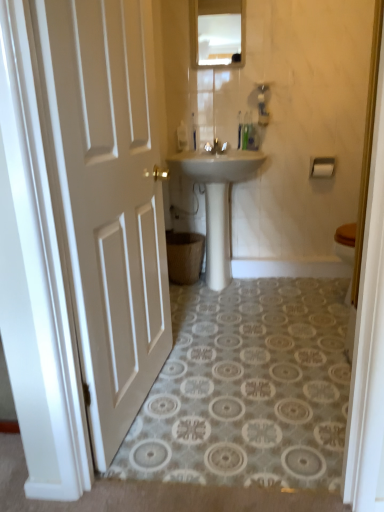
Question: From a real-world perspective, is white matte door at left positioned under glossy glass mirror at upper center based on gravity?

Choices:
 (A) yes
 (B) no

Answer: (A)

Question: Is white matte door at left looking in the opposite direction of glossy glass mirror at upper center?

Choices:
 (A) yes
 (B) no

Answer: (B)

Question: Is white matte door at left positioned in front of glossy glass mirror at upper center?

Choices:
 (A) no
 (B) yes

Answer: (B)

Question: Is there a large distance between white matte door at left and glossy glass mirror at upper center?

Choices:
 (A) no
 (B) yes

Answer: (B)

Question: Is white matte door at left surrounding glossy glass mirror at upper center?

Choices:
 (A) no
 (B) yes

Answer: (A)

Question: Based on their sizes in the image, would you say white matte door at left is bigger or smaller than matte white faucet at center?

Choices:
 (A) big
 (B) small

Answer: (A)

Question: Is point (107, 131) closer or farther from the camera than point (213, 139)?

Choices:
 (A) farther
 (B) closer

Answer: (B)

Question: In the image, is white matte door at left positioned in front of or behind matte white faucet at center?

Choices:
 (A) front
 (B) behind

Answer: (A)

Question: In the image, is white matte door at left on the left side or the right side of matte white faucet at center?

Choices:
 (A) right
 (B) left

Answer: (B)

Question: From the image's perspective, is matte white faucet at center positioned above or below white matte door at left?

Choices:
 (A) above
 (B) below

Answer: (A)

Question: Looking at their shapes, would you say matte white faucet at center is wider or thinner than white matte door at left?

Choices:
 (A) wide
 (B) thin

Answer: (B)

Question: Does point (216, 142) appear closer or farther from the camera than point (125, 331)?

Choices:
 (A) closer
 (B) farther

Answer: (B)

Question: Considering their positions, is matte white faucet at center located in front of or behind white matte door at left?

Choices:
 (A) front
 (B) behind

Answer: (B)

Question: Is point (226, 224) positioned closer to the camera than point (230, 47)?

Choices:
 (A) closer
 (B) farther

Answer: (B)

Question: From a real-world perspective, is white glossy sink at center physically located above or below glossy glass mirror at upper center?

Choices:
 (A) below
 (B) above

Answer: (A)